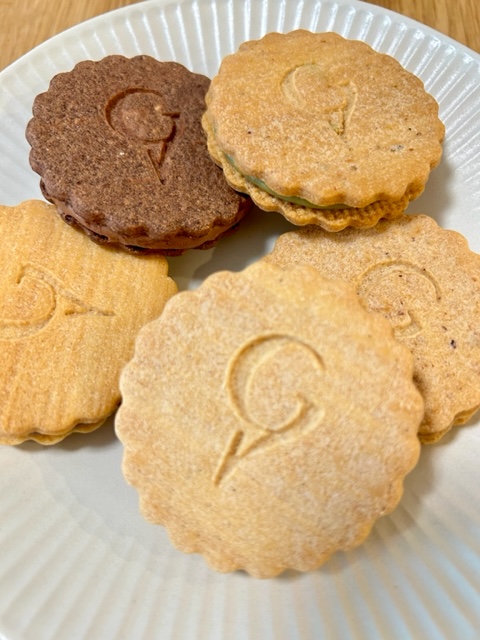
The height and width of the screenshot is (640, 480). What are the coordinates of `ridges along the rim of white plate` in the screenshot? It's located at (188, 29).